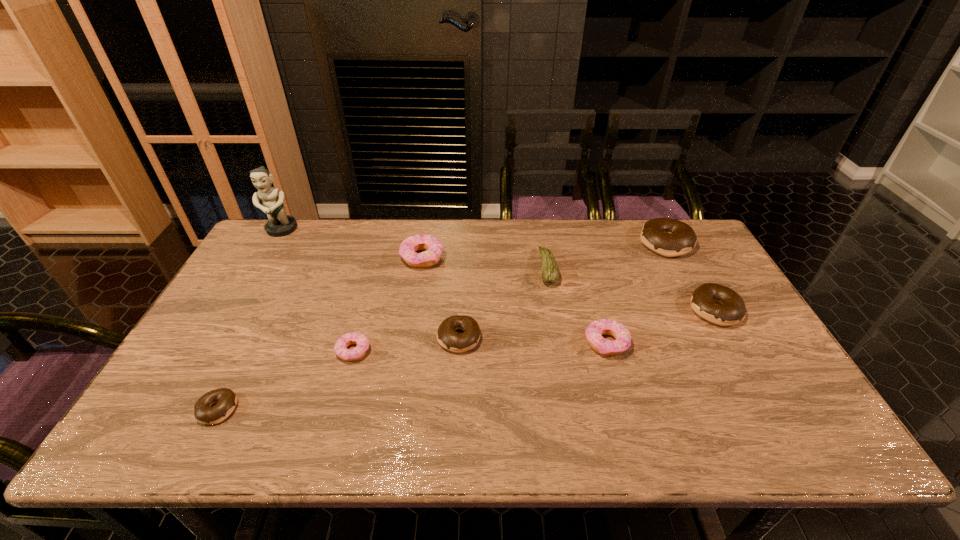
Find the location of `the second biggest pink doughnut`. the second biggest pink doughnut is located at coordinates (595, 330).

Identify the location of the third biggest brown doughnut. (447, 337).

What are the coordinates of `the fifth object from right to left` in the screenshot? It's located at (447, 337).

Find the location of a particular element. The height and width of the screenshot is (540, 960). the smallest pink doughnut is located at coordinates (340, 348).

At what (x,y) coordinates should I click in order to perform the action: click on the third object from left to right. Please return your answer as a coordinate pair (x, y). The width and height of the screenshot is (960, 540). Looking at the image, I should click on (340, 348).

This screenshot has height=540, width=960. I want to click on the nearest object, so click(x=226, y=399).

In order to click on the smallest brown doughnut in this screenshot , I will do `click(226, 399)`.

Where is `vacant space located 0.280m on the front-facing side of the green figurine`? The image size is (960, 540). vacant space located 0.280m on the front-facing side of the green figurine is located at coordinates (243, 296).

This screenshot has height=540, width=960. I want to click on vacant space positioned 0.380m on the left of the farthest brown doughnut, so click(528, 244).

Locate an element on the screen. The height and width of the screenshot is (540, 960). free region located 0.170m at the stem end of the green zucchini is located at coordinates (485, 268).